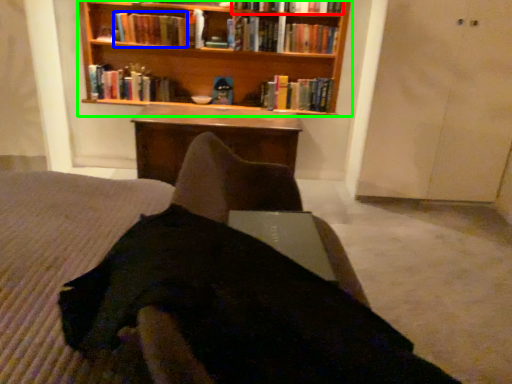
Question: Estimate the real-world distances between objects in this image. Which object is farther from book (highlighted by a red box), book (highlighted by a blue box) or bookcase (highlighted by a green box)?

Choices:
 (A) book
 (B) bookcase

Answer: (A)